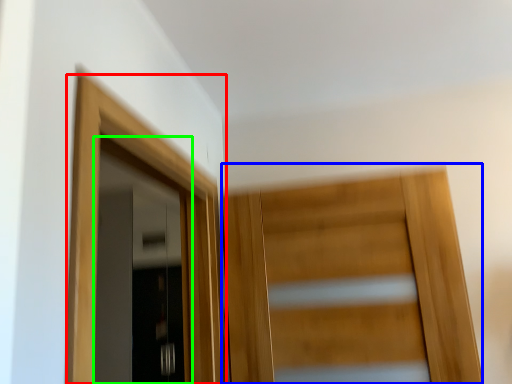
Question: Which object is the farthest from door (highlighted by a red box)? Choose among these: door (highlighted by a blue box) or door (highlighted by a green box).

Choices:
 (A) door
 (B) door

Answer: (B)